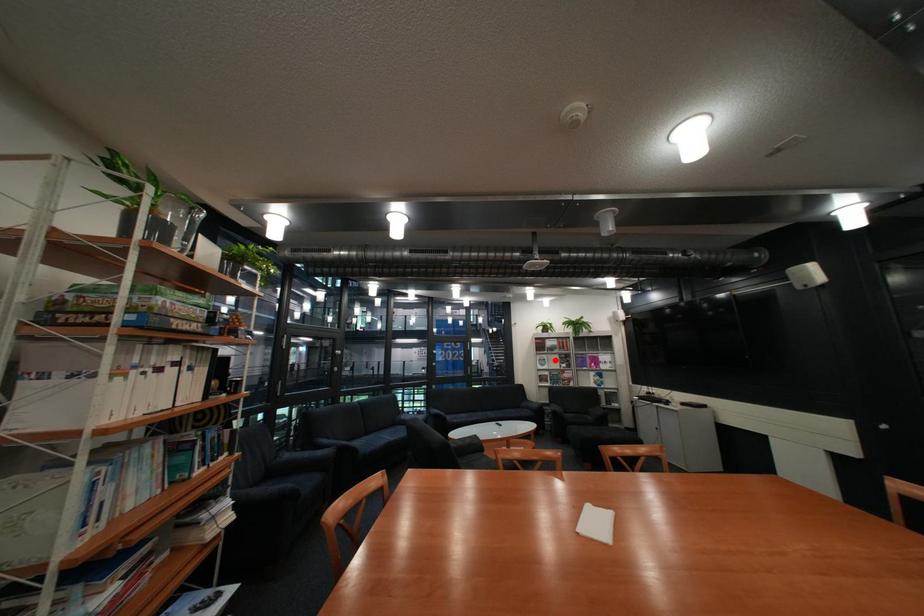
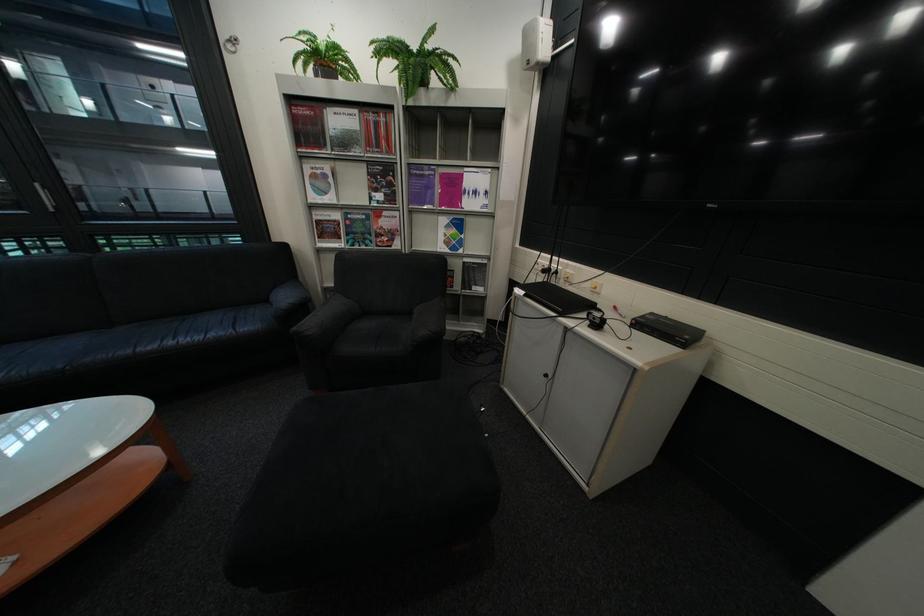
Question: I am providing you with two images of the same scene from different viewpoints. In image1, a red point is highlighted. Considering the same 3D point in image2, which of the following is correct?

Choices:
 (A) It is closer
 (B) It is farther

Answer: (A)